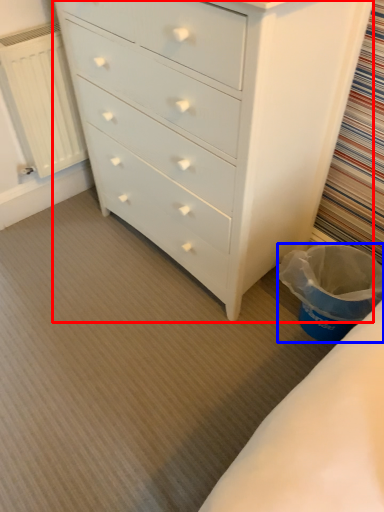
Question: Which point is further to the camera, chest of drawers (highlighted by a red box) or laundry basket (highlighted by a blue box)?

Choices:
 (A) chest of drawers
 (B) laundry basket

Answer: (B)